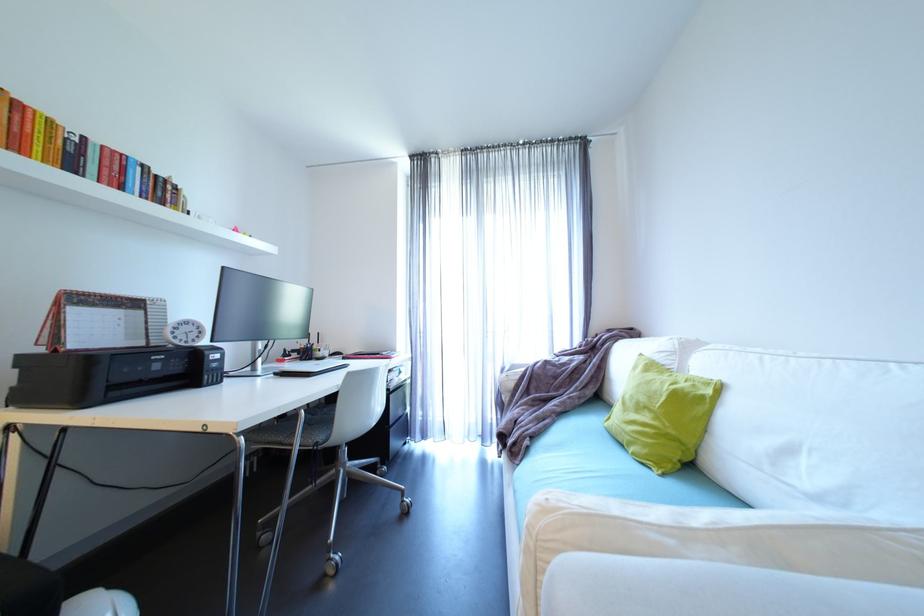
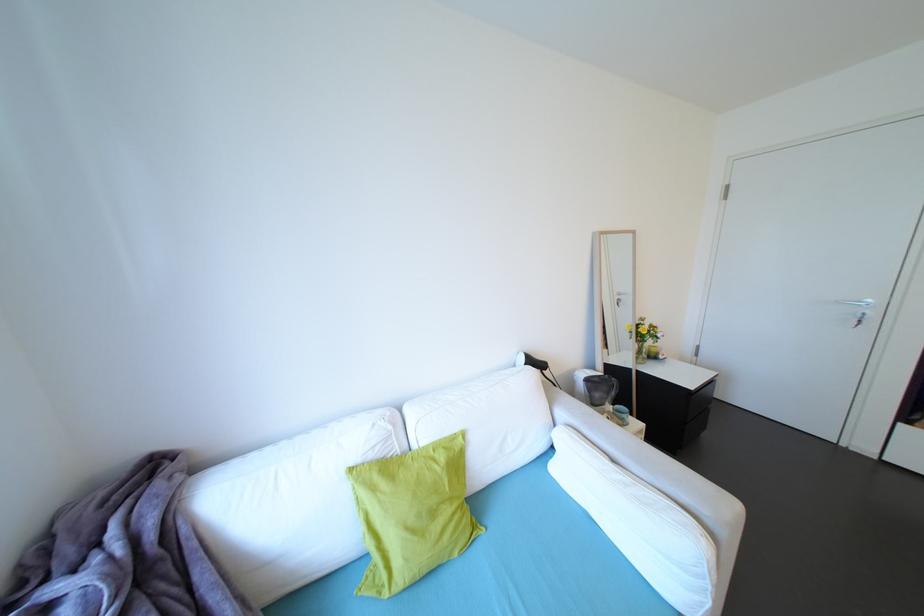
Locate, in the second image, the point that corresponds to (x=638, y=453) in the first image.

(464, 556)